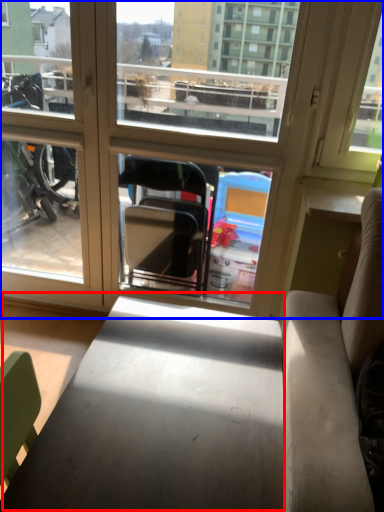
Question: Which of the following is the farthest to the observer, table (highlighted by a red box) or window (highlighted by a blue box)?

Choices:
 (A) table
 (B) window

Answer: (B)